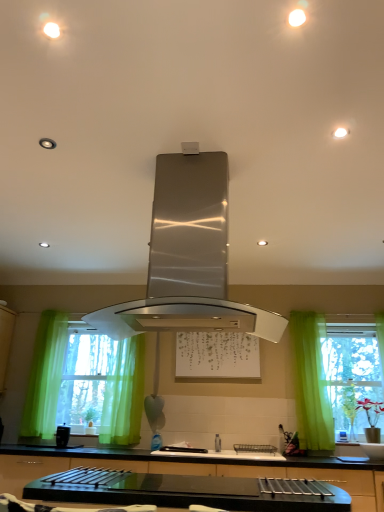
Locate an element on the screen. This screenshot has height=512, width=384. unoccupied space behind satin nickel faucet at center is located at coordinates (225, 450).